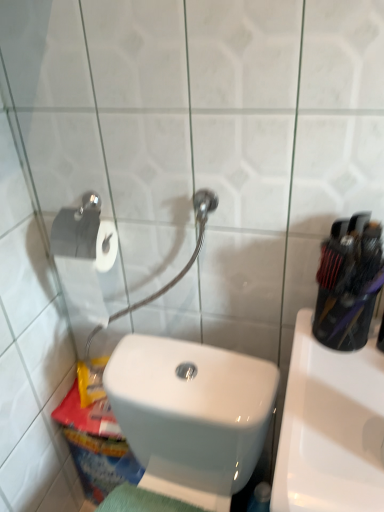
Question: From the image's perspective, is white glossy toilet at lower left positioned above or below white glossy sink at right?

Choices:
 (A) above
 (B) below

Answer: (B)

Question: In the image, is white glossy toilet at lower left positioned in front of or behind white glossy sink at right?

Choices:
 (A) behind
 (B) front

Answer: (B)

Question: From a real-world perspective, is white glossy toilet at lower left positioned above or below white glossy sink at right?

Choices:
 (A) above
 (B) below

Answer: (A)

Question: Do you think white glossy sink at right is within white glossy toilet at lower left, or outside of it?

Choices:
 (A) inside
 (B) outside

Answer: (B)

Question: Considering the positions of white glossy sink at right and white glossy toilet at lower left in the image, is white glossy sink at right bigger or smaller than white glossy toilet at lower left?

Choices:
 (A) small
 (B) big

Answer: (A)

Question: From the image's perspective, is white glossy sink at right positioned above or below white glossy toilet at lower left?

Choices:
 (A) above
 (B) below

Answer: (A)

Question: Looking at their shapes, would you say white glossy sink at right is wider or thinner than white glossy toilet at lower left?

Choices:
 (A) wide
 (B) thin

Answer: (A)